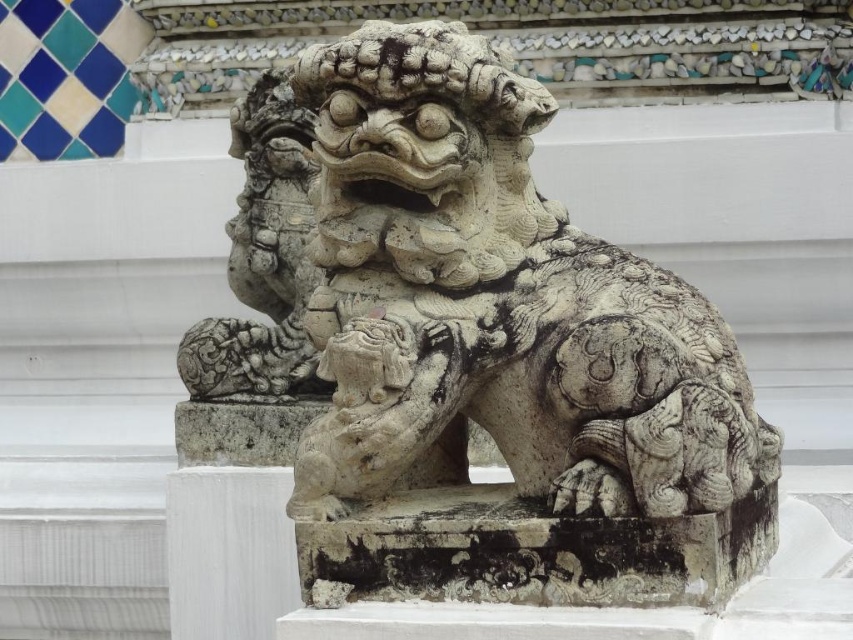
Can you confirm if white stone lion at center is bigger than white marble pillar at center?

Yes, white stone lion at center is bigger than white marble pillar at center.

Who is higher up, white stone lion at center or white marble pillar at center?

white stone lion at center is above.

Is point (718, 435) positioned behind point (207, 531)?

No.

Where is `white stone lion at center`? white stone lion at center is located at coordinates (468, 349).